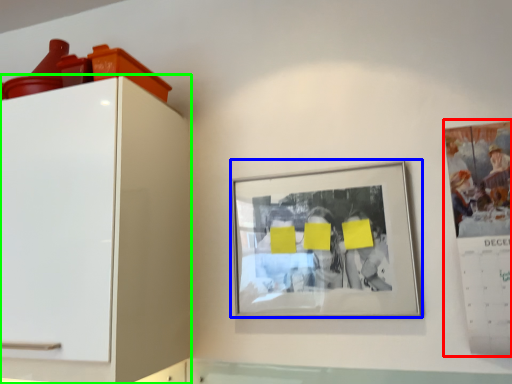
Question: Considering the real-world distances, which object is farthest from poster (highlighted by a red box)? picture frame (highlighted by a blue box) or furniture (highlighted by a green box)?

Choices:
 (A) picture frame
 (B) furniture

Answer: (B)